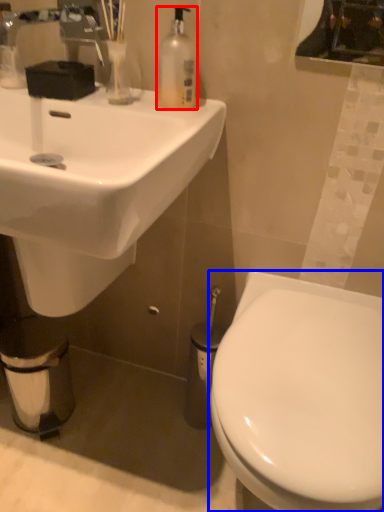
Question: Among these objects, which one is farthest to the camera, bottle (highlighted by a red box) or toilet (highlighted by a blue box)?

Choices:
 (A) bottle
 (B) toilet

Answer: (A)